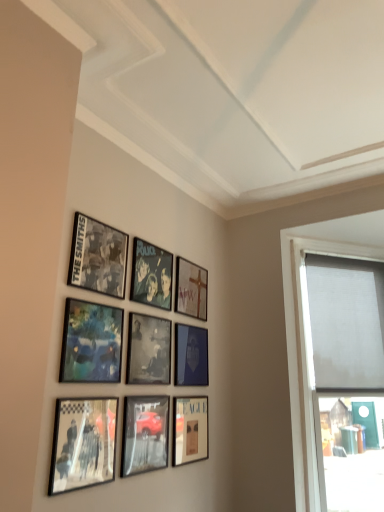
Question: Is point (175, 399) positioned closer to the camera than point (153, 402)?

Choices:
 (A) closer
 (B) farther

Answer: (B)

Question: From a real-world perspective, is matte black picture frame at lower center, positioned as the ninth picture frame in top-to-bottom order, physically located above or below metallic reflective car at lower center, acting as the 8th picture frame starting from the top?

Choices:
 (A) below
 (B) above

Answer: (A)

Question: Which is nearer to the matte black picture frame at center, the 4th picture frame when ordered from bottom to top?

Choices:
 (A) white matte window screen at right
 (B) matte blue painting at center-left, the 4th picture frame positioned from the top
 (C) metallic reflective photo frame at lower left, which is the third picture frame from bottom to top
 (D) black matte picture frame at center, the 5th picture frame from the bottom
 (E) metallic silver photo frame at center, which appears as the second picture frame when viewed from the top

Answer: (D)

Question: Considering the real-world distances, which object is farthest from the matte black picture frame at upper left, the first picture frame when ordered from top to bottom?

Choices:
 (A) matte blue painting at center-left, the 4th picture frame positioned from the top
 (B) matte black picture frame at center, the 4th picture frame when ordered from bottom to top
 (C) matte wooden picture frame at upper center, marked as the seventh picture frame in a bottom-to-top arrangement
 (D) matte black picture frame at lower center, positioned as the ninth picture frame in top-to-bottom order
 (E) metallic silver photo frame at center, which appears as the 8th picture frame when ordered from the bottom

Answer: (D)